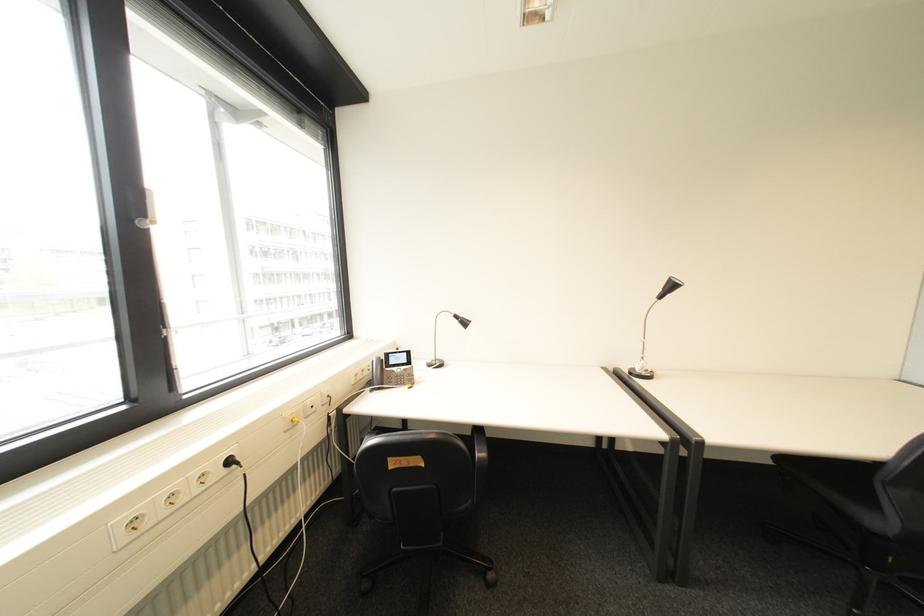
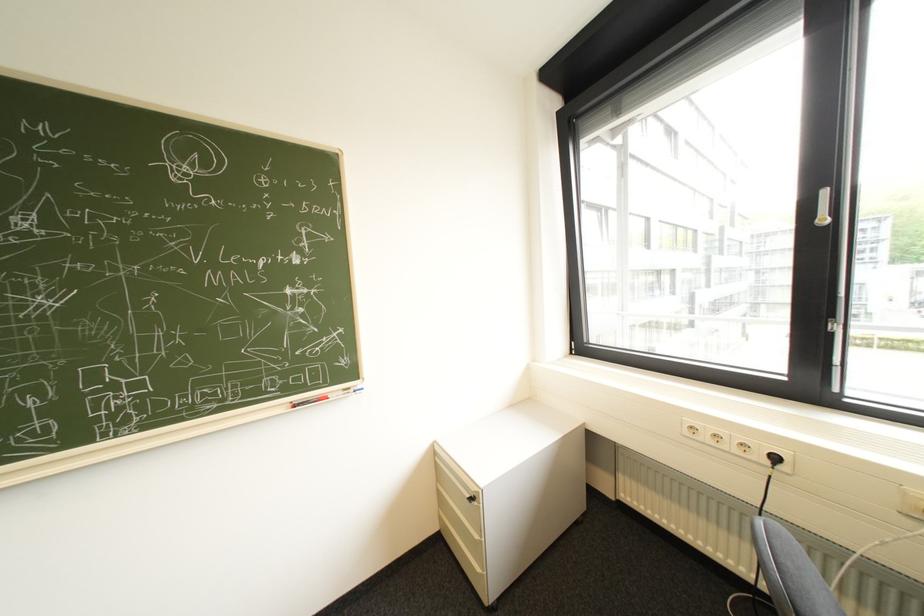
Find the pixel in the second image that matches the point at 167,515 in the first image.

(715, 438)